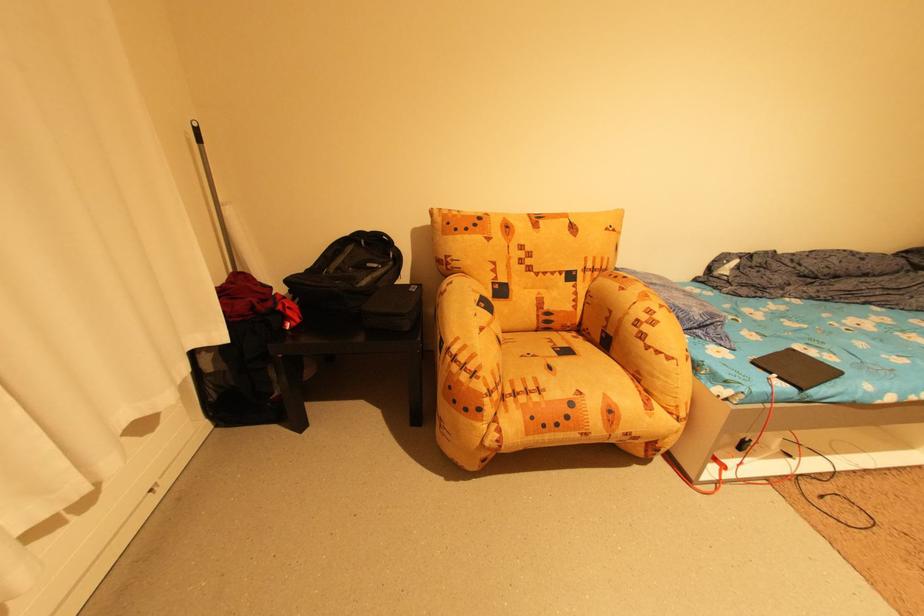
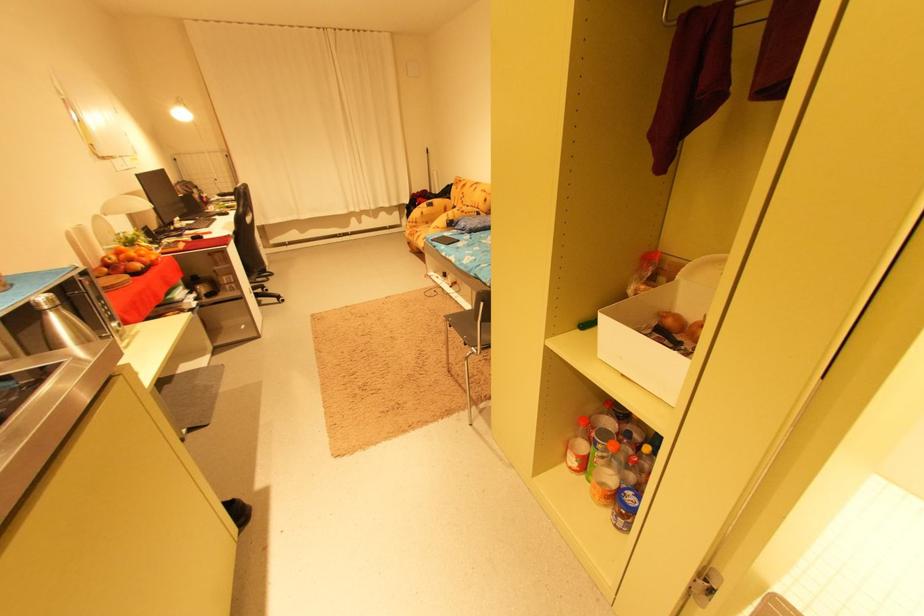
Locate, in the second image, the point that corresponds to (495,238) in the first image.

(464, 188)